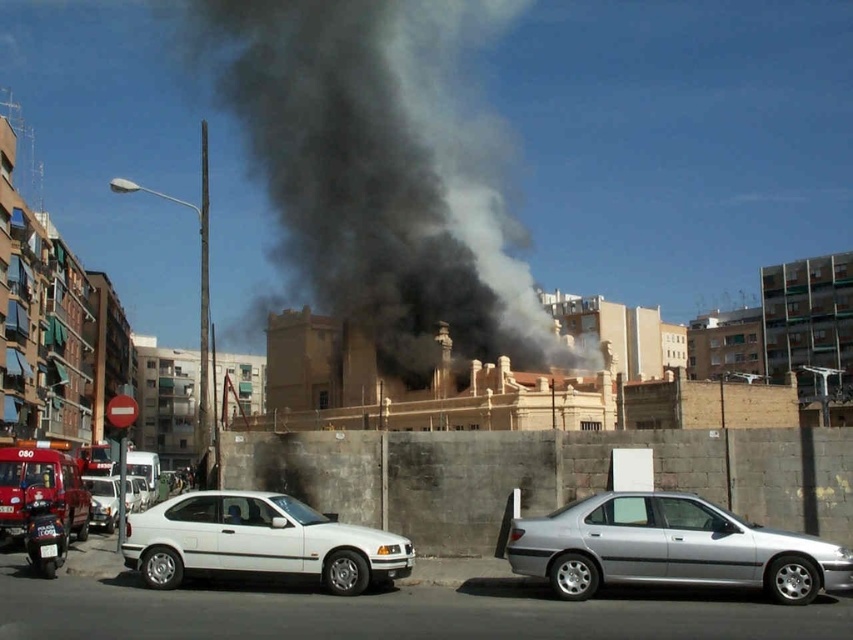
In the scene shown: Is black smoke at center thinner than shiny red fire truck at lower left?

No, black smoke at center is not thinner than shiny red fire truck at lower left.

Can you confirm if black smoke at center is wider than shiny red fire truck at lower left?

Yes.

The height and width of the screenshot is (640, 853). Find the location of `black smoke at center`. black smoke at center is located at coordinates (380, 172).

Based on the photo, does silver metallic sedan at right have a smaller size compared to shiny red fire truck at lower left?

Yes.

Is silver metallic sedan at right thinner than shiny red fire truck at lower left?

Correct, silver metallic sedan at right's width is less than shiny red fire truck at lower left's.

Which is in front, point (630, 570) or point (15, 508)?

Point (630, 570) is more forward.

Locate an element on the screen. The width and height of the screenshot is (853, 640). silver metallic sedan at right is located at coordinates (670, 548).

Between black smoke at center and silver metallic sedan at right, which one appears on the left side from the viewer's perspective?

Positioned to the left is black smoke at center.

Can you confirm if black smoke at center is smaller than silver metallic sedan at right?

No.

Where is `black smoke at center`? This screenshot has width=853, height=640. black smoke at center is located at coordinates (380, 172).